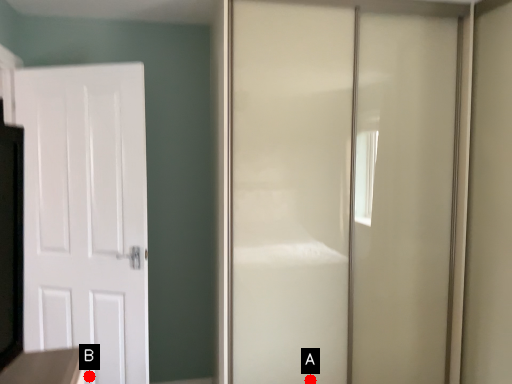
Question: Two points are circled on the image, labeled by A and B beside each circle. Which point is closer to the camera?

Choices:
 (A) A is closer
 (B) B is closer

Answer: (A)